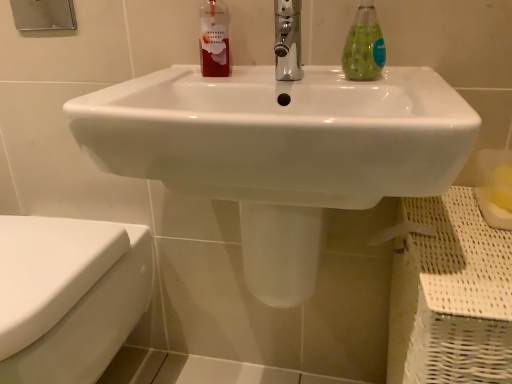
Question: Can you confirm if chrome metallic faucet at center is positioned to the left of translucent green liquid at sink right?

Choices:
 (A) yes
 (B) no

Answer: (A)

Question: Does chrome metallic faucet at center have a greater width compared to translucent green liquid at sink right?

Choices:
 (A) yes
 (B) no

Answer: (A)

Question: Is chrome metallic faucet at center located outside translucent green liquid at sink right?

Choices:
 (A) yes
 (B) no

Answer: (A)

Question: From a real-world perspective, is chrome metallic faucet at center on top of translucent green liquid at sink right?

Choices:
 (A) yes
 (B) no

Answer: (B)

Question: Is chrome metallic faucet at center closer to the viewer compared to translucent green liquid at sink right?

Choices:
 (A) yes
 (B) no

Answer: (A)

Question: Is point (5, 344) closer or farther from the camera than point (377, 76)?

Choices:
 (A) farther
 (B) closer

Answer: (B)

Question: In terms of size, does white glossy toilet at lower left appear bigger or smaller than translucent green liquid at sink right?

Choices:
 (A) small
 (B) big

Answer: (B)

Question: From the image's perspective, is white glossy toilet at lower left above or below translucent green liquid at sink right?

Choices:
 (A) above
 (B) below

Answer: (B)

Question: From a real-world perspective, is white glossy toilet at lower left positioned above or below translucent green liquid at sink right?

Choices:
 (A) below
 (B) above

Answer: (A)

Question: From the image's perspective, relative to white glossy toilet at lower left, is white glossy sink at center above or below?

Choices:
 (A) below
 (B) above

Answer: (B)

Question: In terms of size, does white glossy sink at center appear bigger or smaller than white glossy toilet at lower left?

Choices:
 (A) small
 (B) big

Answer: (B)

Question: Considering their positions, is white glossy sink at center located in front of or behind white glossy toilet at lower left?

Choices:
 (A) behind
 (B) front

Answer: (B)

Question: From a real-world perspective, is white glossy sink at center physically located above or below white glossy toilet at lower left?

Choices:
 (A) below
 (B) above

Answer: (B)

Question: Is translucent green liquid at sink right wider or thinner than chrome metallic faucet at center?

Choices:
 (A) wide
 (B) thin

Answer: (B)

Question: In the image, is translucent green liquid at sink right on the left side or the right side of chrome metallic faucet at center?

Choices:
 (A) right
 (B) left

Answer: (A)